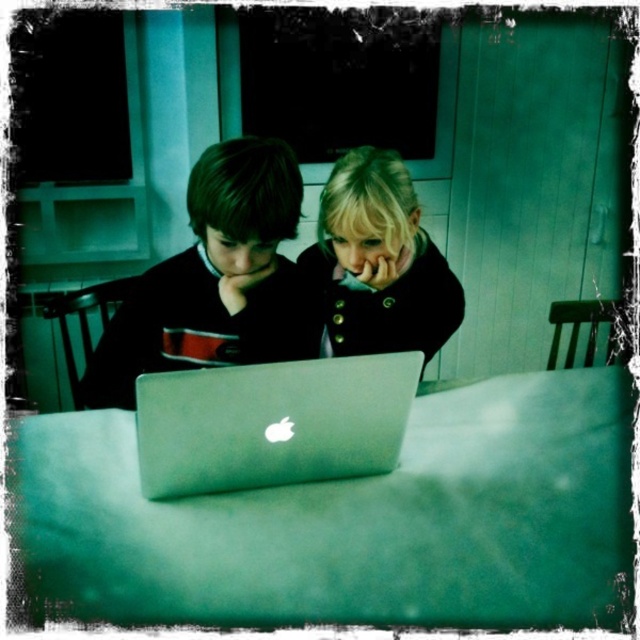
Question: Is matte black laptop at center to the left of silver metallic laptop at center from the viewer's perspective?

Choices:
 (A) yes
 (B) no

Answer: (A)

Question: Which point is closer to the camera?

Choices:
 (A) (333, 257)
 (B) (268, 476)
 (C) (230, 522)

Answer: (C)

Question: Which point appears farthest from the camera in this image?

Choices:
 (A) (500, 376)
 (B) (384, 244)
 (C) (275, 147)
 (D) (292, 472)

Answer: (A)

Question: Observing the image, what is the correct spatial positioning of silver metallic laptop at center in reference to matte black coat at center?

Choices:
 (A) right
 (B) left

Answer: (B)

Question: Which point is farther to the camera?

Choices:
 (A) (586, 369)
 (B) (280, 339)
 (C) (154, 436)
 (D) (417, 284)

Answer: (A)

Question: Can you confirm if metallic silver laptop at center is positioned below matte black coat at center?

Choices:
 (A) no
 (B) yes

Answer: (B)